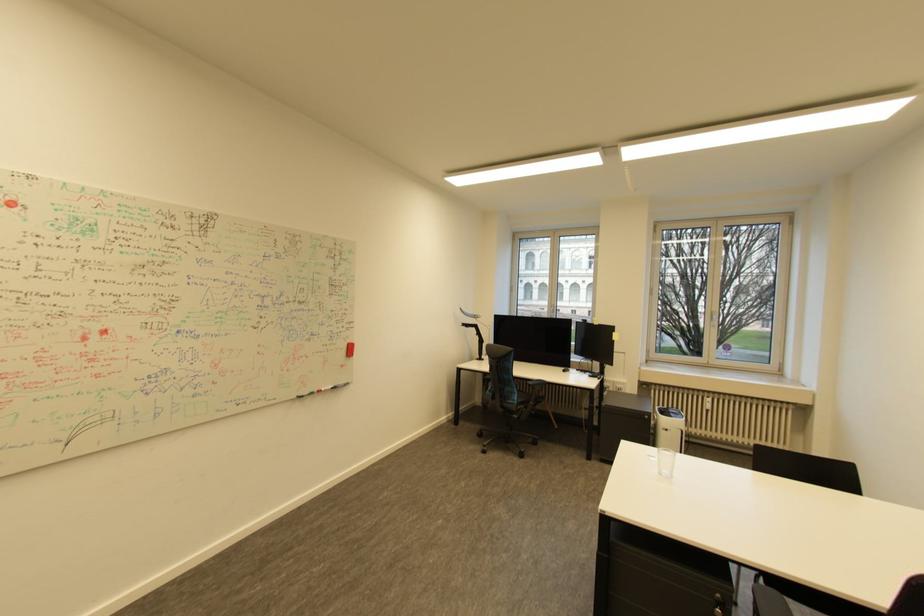
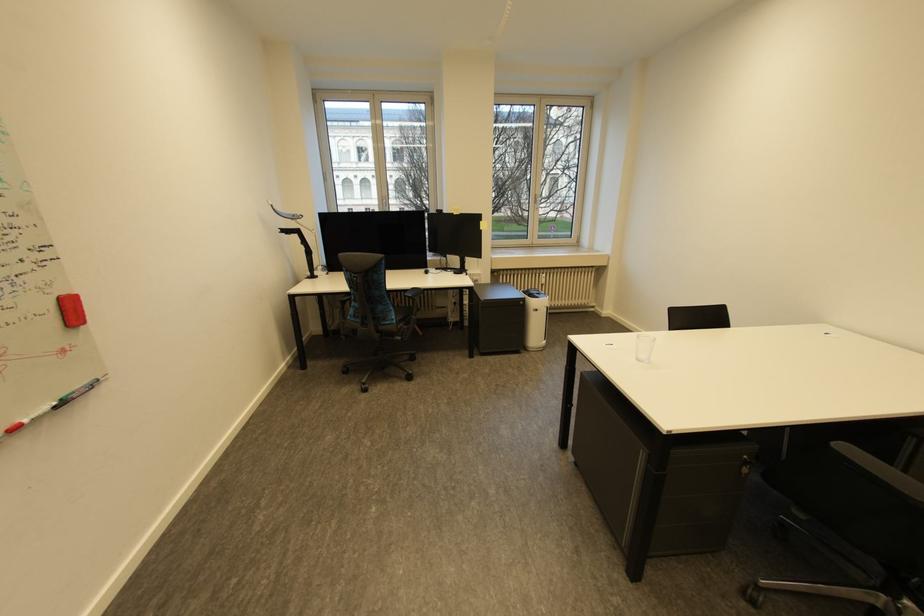
The point at (674,431) is marked in the first image. Where is the corresponding point in the second image?

(543, 310)